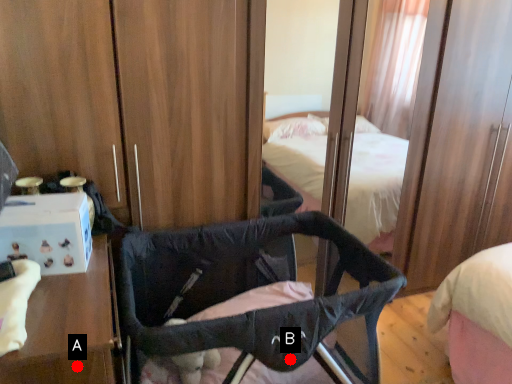
Question: Two points are circled on the image, labeled by A and B beside each circle. Which point is closer to the camera taking this photo?

Choices:
 (A) A is closer
 (B) B is closer

Answer: (A)